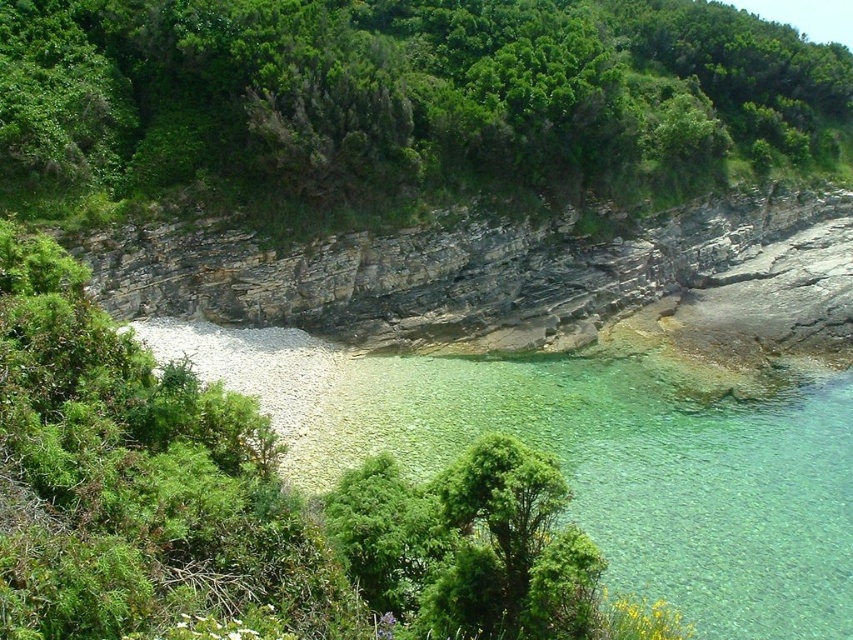
Between green leafy tree at upper center and rocky cliff at center, which one appears on the left side from the viewer's perspective?

From the viewer's perspective, green leafy tree at upper center appears more on the left side.

Is green leafy tree at upper center above rocky cliff at center?

Yes.

Is point (206, 145) positioned before point (239, 296)?

No, it is not.

At what (x,y) coordinates should I click in order to perform the action: click on green leafy tree at upper center. Please return your answer as a coordinate pair (x, y). Looking at the image, I should click on (398, 92).